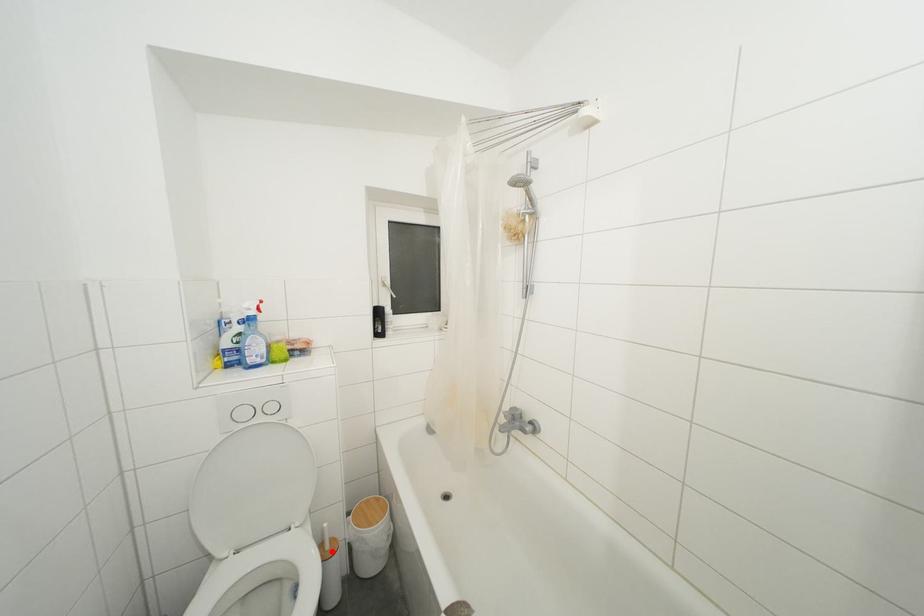
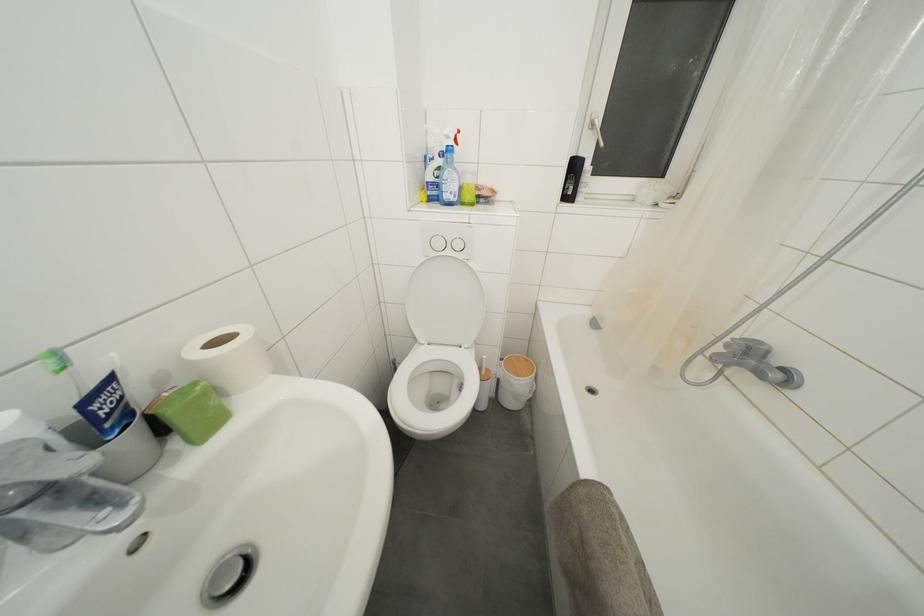
Question: I am providing you with two images of the same scene from different viewpoints. Given a red point in image1, look at the same physical point in image2. Is it:

Choices:
 (A) Closer to the viewpoint
 (B) Farther from the viewpoint

Answer: (B)